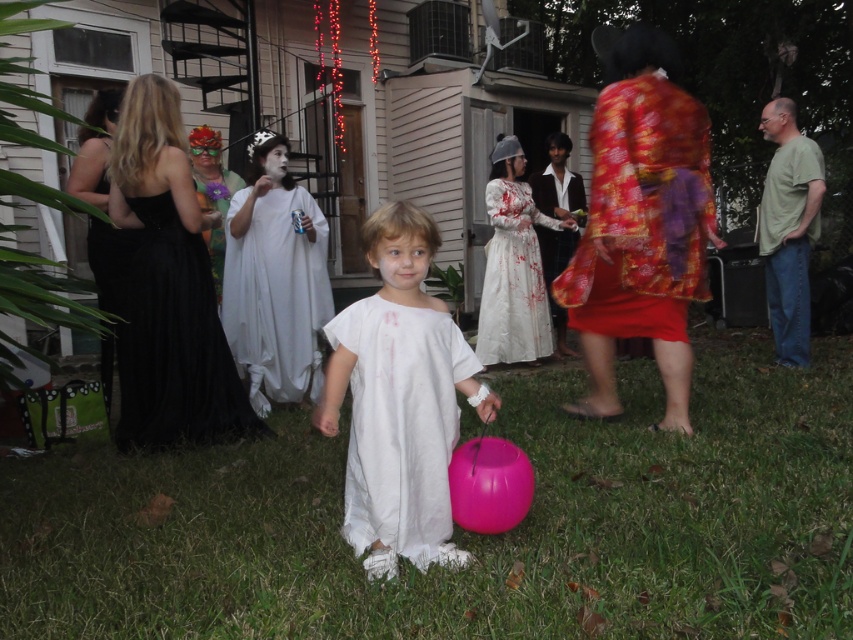
Question: Which object is the closest to the white matte dress at center?

Choices:
 (A) shiny red fabric robe at center
 (B) floral silk robe at right

Answer: (B)

Question: Which point is farther to the camera?

Choices:
 (A) (223, 300)
 (B) (524, 195)
 (C) (682, 260)

Answer: (B)

Question: Is white cotton dress at center above shiny red fabric robe at center?

Choices:
 (A) no
 (B) yes

Answer: (A)

Question: Among these points, which one is nearest to the camera?

Choices:
 (A) (259, 378)
 (B) (688, 141)
 (C) (541, 316)
 (D) (549, 212)

Answer: (B)

Question: Does white matte dress at center appear on the right side of white cotton dress at center?

Choices:
 (A) no
 (B) yes

Answer: (A)

Question: Does black satin dress at upper left appear on the right side of shiny red fabric robe at center?

Choices:
 (A) no
 (B) yes

Answer: (A)